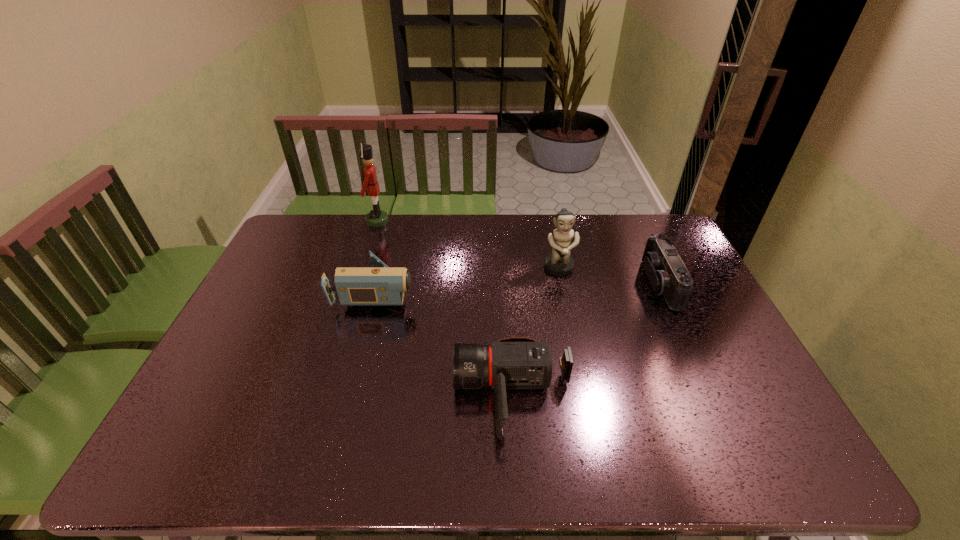
Locate an element on the screen. The image size is (960, 540). vacant space at the near edge of the desktop is located at coordinates (634, 471).

Where is `free space at the left edge of the desktop`? This screenshot has width=960, height=540. free space at the left edge of the desktop is located at coordinates (284, 282).

In the image, there is a desktop. What are the coordinates of `vacant space at the right edge` in the screenshot? It's located at (680, 318).

In the image, there is a desktop. Find the location of `vacant space at the far right corner`. vacant space at the far right corner is located at coordinates (651, 220).

In order to click on vacant space at the near right corner of the desktop in this screenshot , I will do `click(790, 470)`.

Locate an element on the screen. This screenshot has height=540, width=960. free space between the leftmost camcorder and the rightmost object is located at coordinates (518, 287).

You are a GUI agent. You are given a task and a screenshot of the screen. Output one action in this format:
    pyautogui.click(x=<x>, y=<y>)
    Task: Click on the empty location between the fourth shortest object and the nutcracker
    The height and width of the screenshot is (540, 960).
    Given the screenshot: What is the action you would take?
    pyautogui.click(x=468, y=245)

At what (x,y) coordinates should I click in order to perform the action: click on vacant region between the rightmost camcorder and the leftmost camcorder. Please return your answer as a coordinate pair (x, y). The width and height of the screenshot is (960, 540). Looking at the image, I should click on (518, 287).

At what (x,y) coordinates should I click in order to perform the action: click on free space that is in between the farthest object and the rightmost object. Please return your answer as a coordinate pair (x, y). Looking at the image, I should click on (518, 253).

Find the location of a particular element. This screenshot has width=960, height=540. vacant area that lies between the nearest camcorder and the nutcracker is located at coordinates (445, 308).